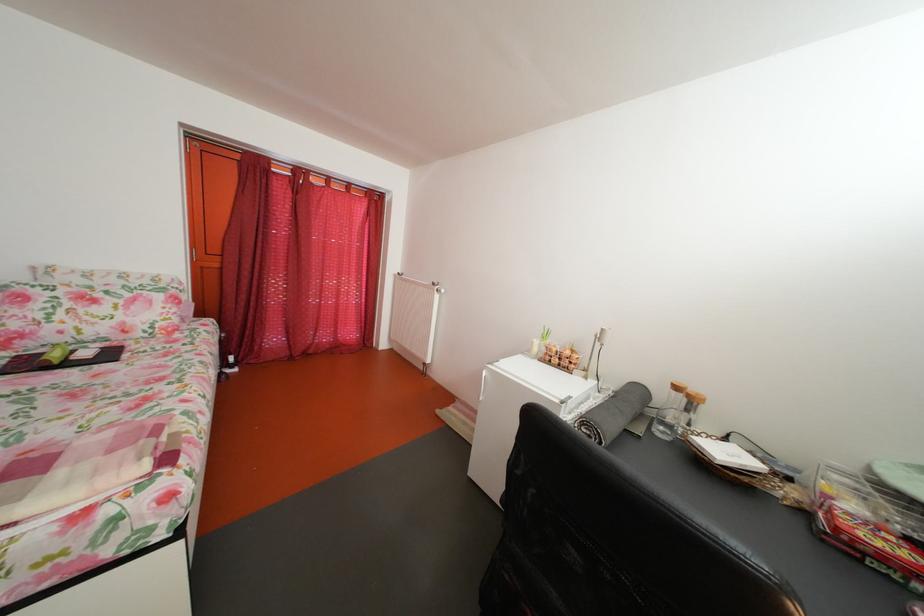
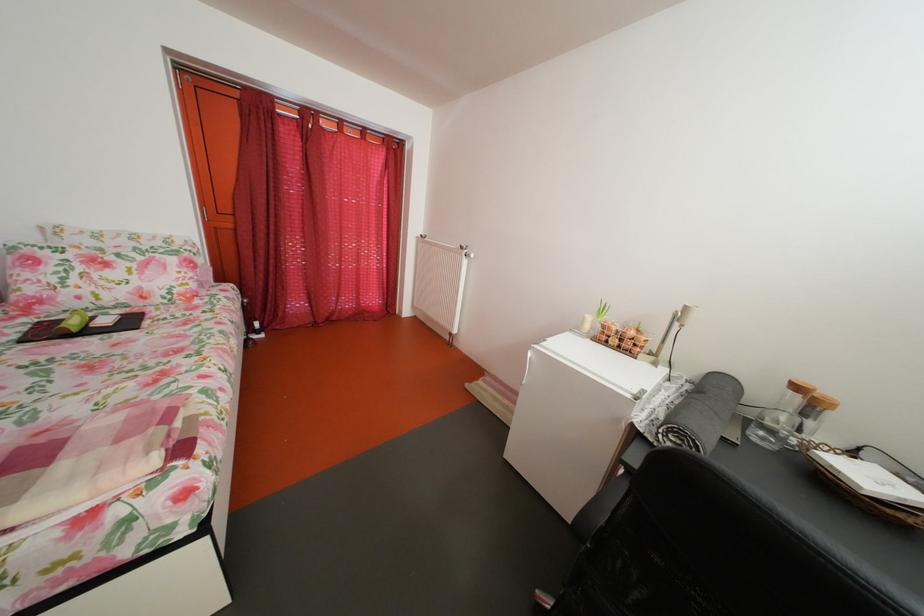
Locate, in the second image, the point that corresponds to pixel 66 363 in the first image.

(83, 330)